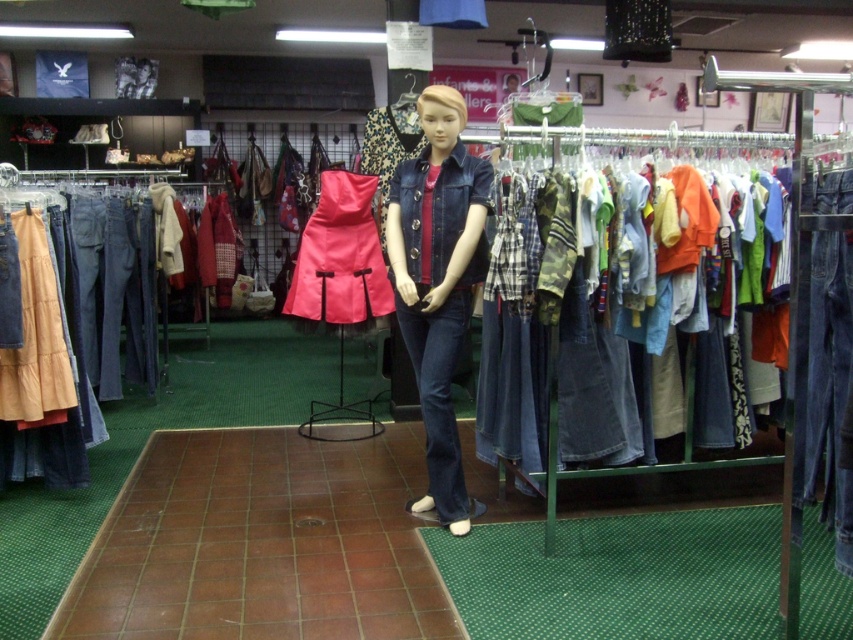
Question: Is denim shirts at center below denim jacket at center?

Choices:
 (A) yes
 (B) no

Answer: (A)

Question: Does denim shirts at center come in front of matte pink fabric dress at center?

Choices:
 (A) no
 (B) yes

Answer: (B)

Question: Which object is farther from the camera taking this photo?

Choices:
 (A) denim jacket at center
 (B) denim shirts at center

Answer: (A)

Question: Among these objects, which one is farthest from the camera?

Choices:
 (A) denim shirts at center
 (B) matte pink fabric dress at center
 (C) denim jacket at center

Answer: (B)

Question: Which point is closer to the camera taking this photo?

Choices:
 (A) (341, 266)
 (B) (74, 224)

Answer: (A)

Question: Considering the relative positions of denim shirts at center and matte pink fabric dress at center in the image provided, where is denim shirts at center located with respect to matte pink fabric dress at center?

Choices:
 (A) right
 (B) left

Answer: (A)